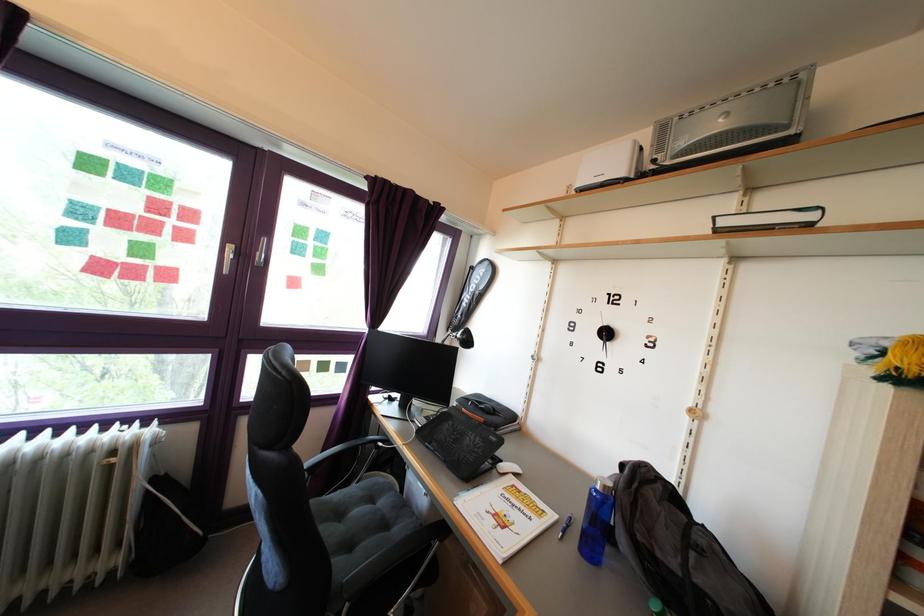
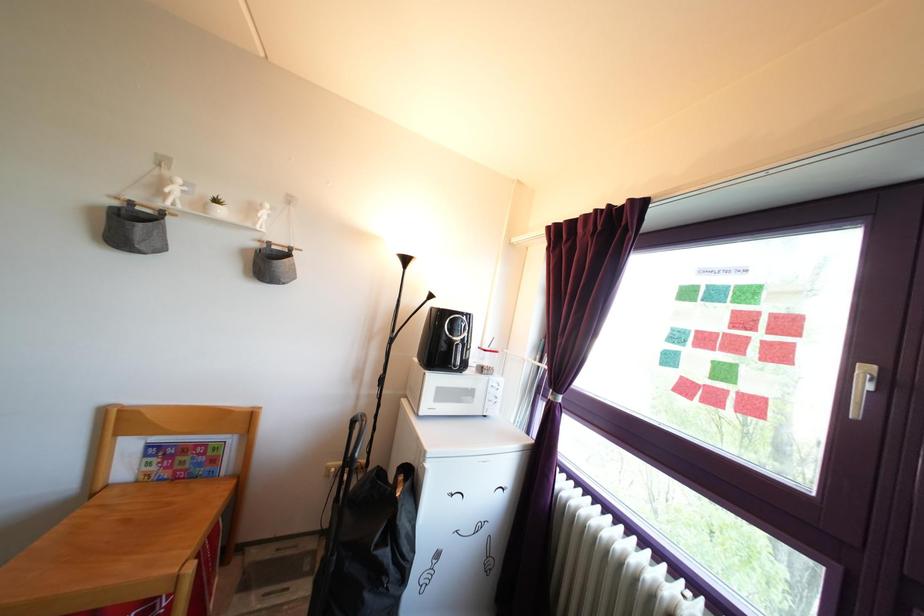
In the second image, find the point that corresponds to (x=175, y=230) in the first image.

(761, 345)